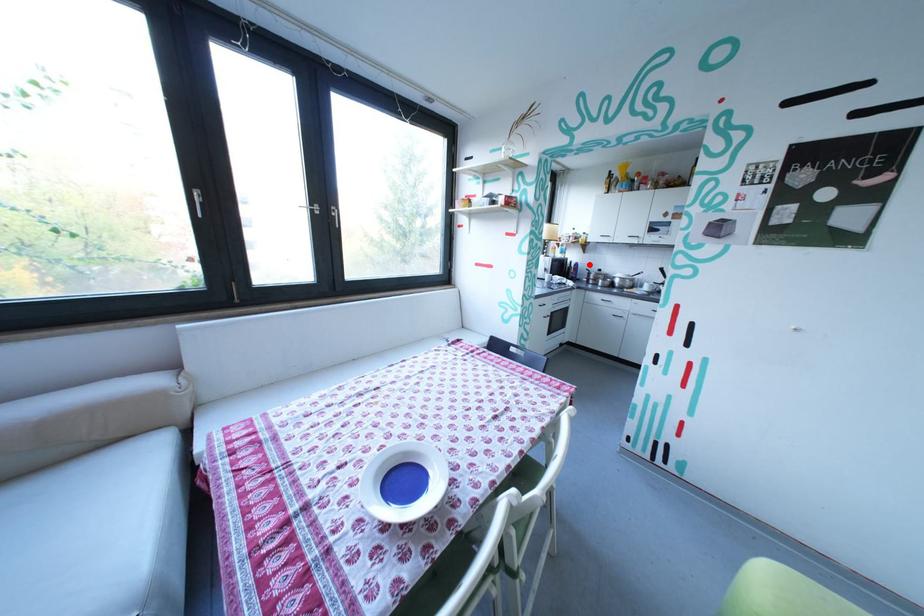
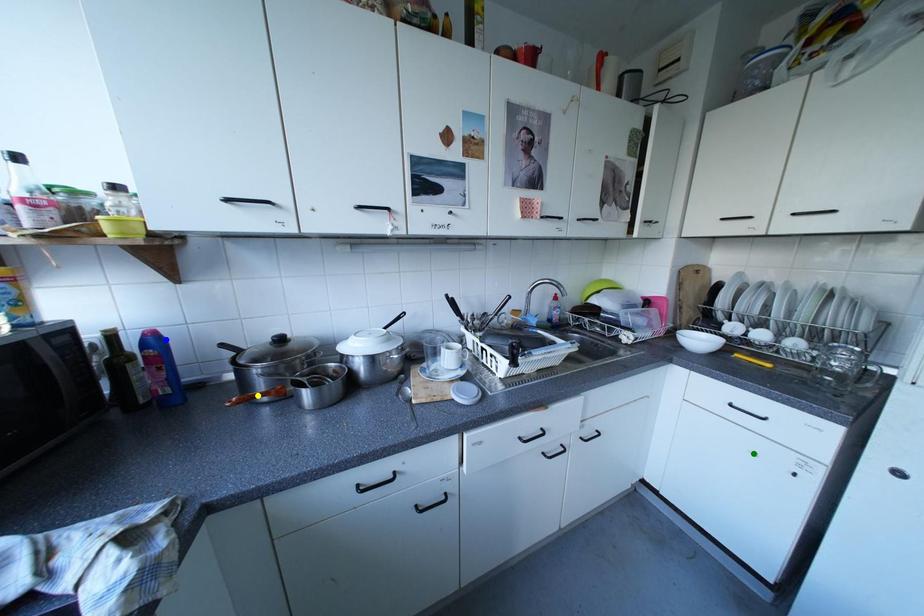
Question: I am providing you with two images of the same scene from different viewpoints. A red point is marked on the first image. You are given multiple points on the second image. Which point in image 2 represents the same 3d spot as the red point in image 1?

Choices:
 (A) green point
 (B) blue point
 (C) yellow point

Answer: (B)